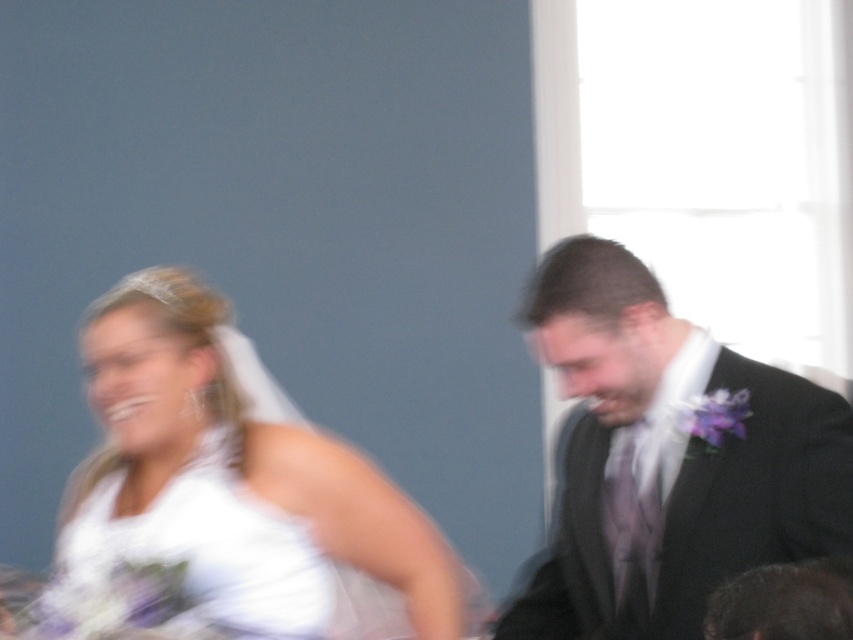
You are a photographer at a wedding. You need to adjust the lighting so that both the white satin dress at left and the matte black suit at right are well lit. Given their positions, which object should you focus on first to ensure proper exposure?

The white satin dress at left is closer to the viewer than the matte black suit at right, so you should focus on adjusting the lighting for the white satin dress at left first to ensure proper exposure.

You are a photographer at a wedding event. You have two dresses in the scene, the white satin dress at left and the white satin wedding dress at left. Which one is wider?

The white satin dress at left is wider than the white satin wedding dress at left according to the description.

Based on the scene description, can you determine if the matte black suit at right is covering part of the white satin wedding dress at left?

The matte black suit at right is positioned over white satin wedding dress at left, so yes, it is covering part of the white satin wedding dress at left.